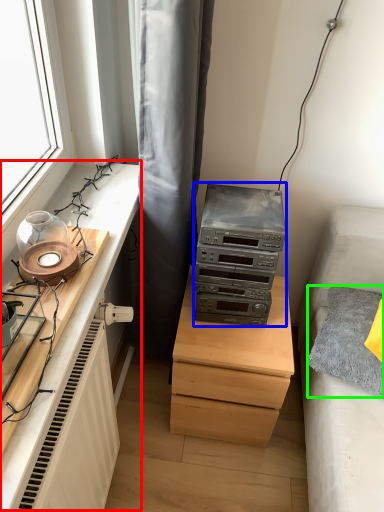
Question: Estimate the real-world distances between objects in this image. Which object is farther from entertainment center (highlighted by a red box), stereo (highlighted by a blue box) or pillow (highlighted by a green box)?

Choices:
 (A) stereo
 (B) pillow

Answer: (B)